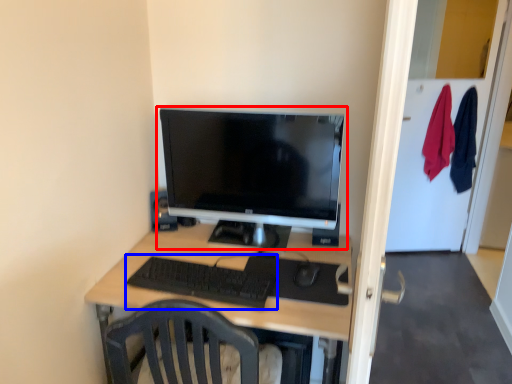
Question: Among these objects, which one is farthest to the camera, computer monitor (highlighted by a red box) or computer keyboard (highlighted by a blue box)?

Choices:
 (A) computer monitor
 (B) computer keyboard

Answer: (A)